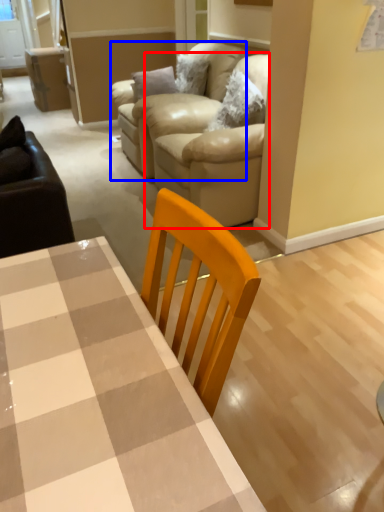
Question: Which object is further to the camera taking this photo, couch (highlighted by a red box) or armchair (highlighted by a blue box)?

Choices:
 (A) couch
 (B) armchair

Answer: (B)